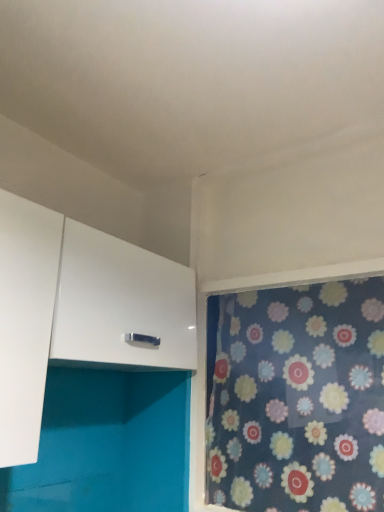
Question: Is white glossy cabinet at upper left closer to camera compared to floral fabric curtain at right?

Choices:
 (A) yes
 (B) no

Answer: (A)

Question: Is white glossy cabinet at upper left directly adjacent to floral fabric curtain at right?

Choices:
 (A) no
 (B) yes

Answer: (A)

Question: From the image's perspective, is white glossy cabinet at upper left above floral fabric curtain at right?

Choices:
 (A) no
 (B) yes

Answer: (B)

Question: Is white glossy cabinet at upper left bigger than floral fabric curtain at right?

Choices:
 (A) yes
 (B) no

Answer: (A)

Question: Is white glossy cabinet at upper left further to the viewer compared to floral fabric curtain at right?

Choices:
 (A) yes
 (B) no

Answer: (B)

Question: Is white glossy cabinet at upper left positioned with its back to floral fabric curtain at right?

Choices:
 (A) yes
 (B) no

Answer: (B)

Question: Is floral fabric curtain at right not inside white glossy cabinet at upper left?

Choices:
 (A) yes
 (B) no

Answer: (A)

Question: Considering the relative sizes of floral fabric curtain at right and white glossy cabinet at upper left in the image provided, is floral fabric curtain at right shorter than white glossy cabinet at upper left?

Choices:
 (A) no
 (B) yes

Answer: (A)

Question: From the image's perspective, does floral fabric curtain at right appear lower than white glossy cabinet at upper left?

Choices:
 (A) yes
 (B) no

Answer: (A)

Question: Is floral fabric curtain at right smaller than white glossy cabinet at upper left?

Choices:
 (A) no
 (B) yes

Answer: (B)

Question: Considering the relative positions of floral fabric curtain at right and white glossy cabinet at upper left in the image provided, is floral fabric curtain at right to the left of white glossy cabinet at upper left from the viewer's perspective?

Choices:
 (A) yes
 (B) no

Answer: (B)

Question: Is floral fabric curtain at right further to camera compared to white glossy cabinet at upper left?

Choices:
 (A) no
 (B) yes

Answer: (B)

Question: From a real-world perspective, relative to white glossy cabinet at upper left, is floral fabric curtain at right vertically above or below?

Choices:
 (A) below
 (B) above

Answer: (A)